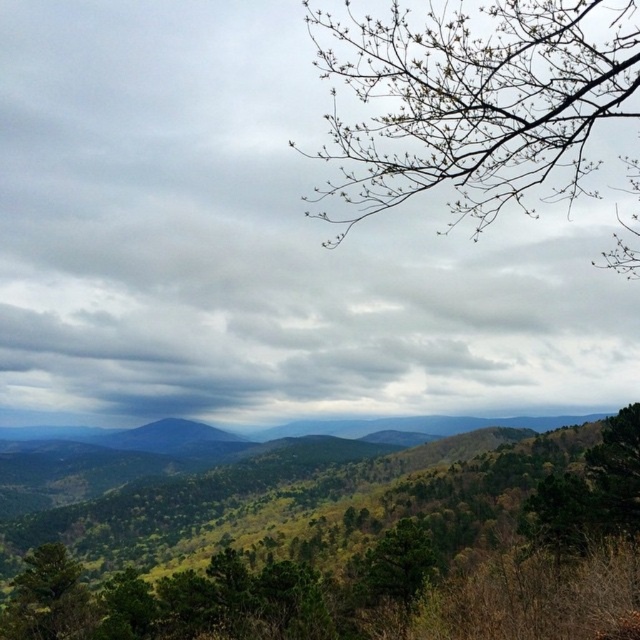
You are an environmental scientist assessing the health of the forest. You observe the green leafy tree at center and the bare branches at upper right. Which tree is more to the left in the image?

The green leafy tree at center is positioned on the left side of the bare branches at upper right, so it is more to the left in the image.

You are an outdoor photographer planning to capture the mountain landscape. You want to ensure that both the green leafy tree at center and the bare branches at upper right are clearly visible in your photo. Based on their positions, which object will appear closer to the camera in the final image?

The green leafy tree at center will appear closer to the camera because it is further to the viewer than the bare branches at upper right, meaning it is positioned nearer in the scene.

You are an environmental scientist assessing the landscape. You notice the green leafy tree at center and the bare branches at upper right. Based on their heights, which one might be younger? Please explain your reasoning.

The green leafy tree at center has a lesser height compared to the bare branches at upper right. Since younger trees are typically shorter than older ones, the green leafy tree at center is likely the younger one.